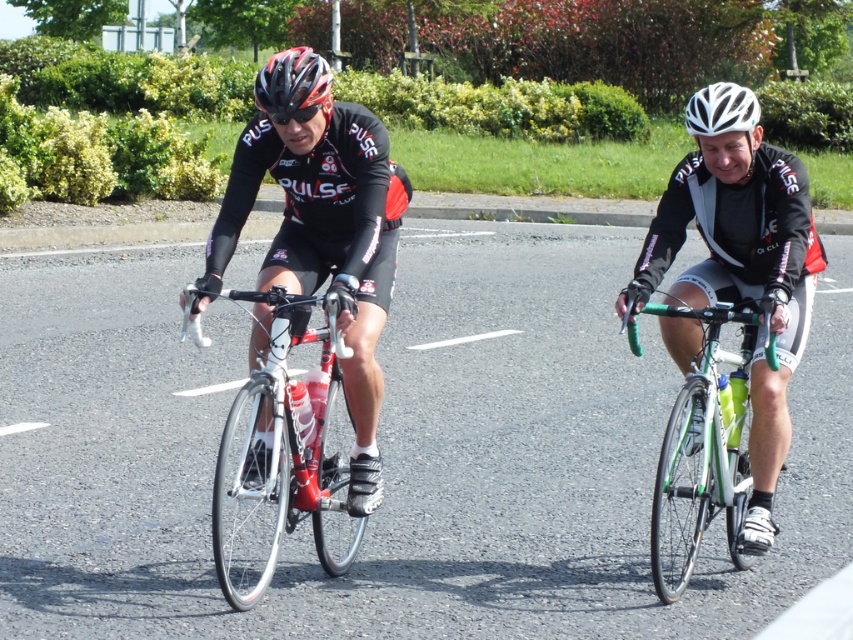
How distant is shiny metallic bicycle at center from green metallic bicycle at right?

The distance of shiny metallic bicycle at center from green metallic bicycle at right is 5.09 feet.

Between shiny metallic bicycle at center and green metallic bicycle at right, which one is positioned higher?

green metallic bicycle at right is above.

Who is more forward, (262, 499) or (630, 326)?

Point (262, 499) is in front.

Locate an element on the screen. The height and width of the screenshot is (640, 853). shiny metallic bicycle at center is located at coordinates (282, 456).

Can you confirm if green metallic bicycle at right is positioned above white matte bicycle helmet at upper center?

Actually, green metallic bicycle at right is below white matte bicycle helmet at upper center.

Who is more distant from viewer, (711, 502) or (700, 131)?

The point (711, 502) is more distant.

What do you see at coordinates (701, 451) in the screenshot? I see `green metallic bicycle at right` at bounding box center [701, 451].

I want to click on green metallic bicycle at right, so click(701, 451).

In the scene shown: Is green metallic bicycle at right to the left of matte black helmet at center from the viewer's perspective?

No, green metallic bicycle at right is not to the left of matte black helmet at center.

Does green metallic bicycle at right come behind matte black helmet at center?

That is True.

Image resolution: width=853 pixels, height=640 pixels. What do you see at coordinates (701, 451) in the screenshot?
I see `green metallic bicycle at right` at bounding box center [701, 451].

Find the location of a particular element. The width and height of the screenshot is (853, 640). green metallic bicycle at right is located at coordinates coord(701,451).